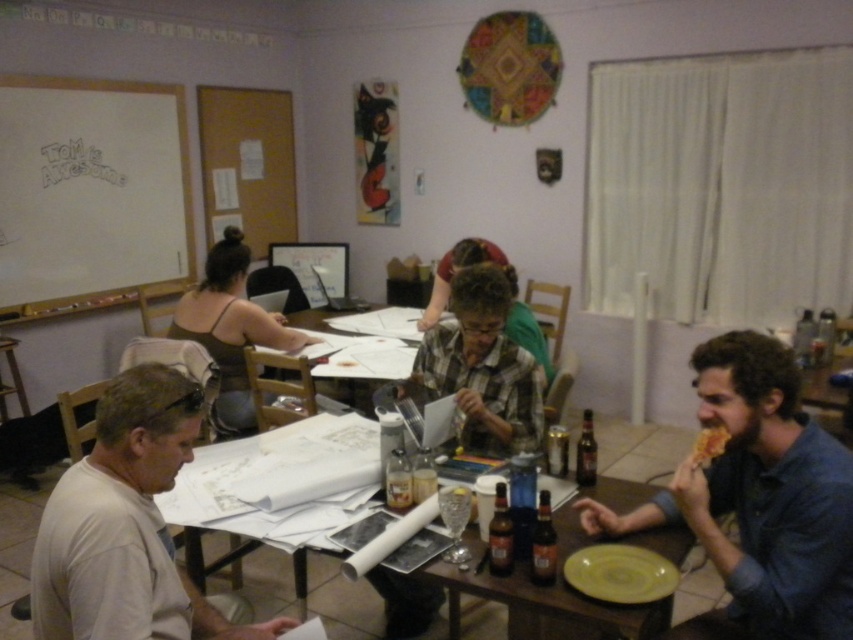
Question: Does white matte shirt at lower left lie in front of white paper at center?

Choices:
 (A) yes
 (B) no

Answer: (A)

Question: Estimate the real-world distances between objects in this image. Which object is closer to the brown glass bottle at table center?

Choices:
 (A) plaid shirt at center
 (B) white paper at center

Answer: (A)

Question: Estimate the real-world distances between objects in this image. Which object is farther from the brown fabric shirt at upper left?

Choices:
 (A) wooden table at center
 (B) white matte shirt at lower left
 (C) white matte dry erase board at upper left

Answer: (B)

Question: Is blue denim shirt at lower right below wooden table at center?

Choices:
 (A) yes
 (B) no

Answer: (B)

Question: Which of the following is the closest to the observer?

Choices:
 (A) (694, 451)
 (B) (155, 525)

Answer: (B)

Question: Is blue denim shirt at lower right positioned in front of white paper at center?

Choices:
 (A) yes
 (B) no

Answer: (A)